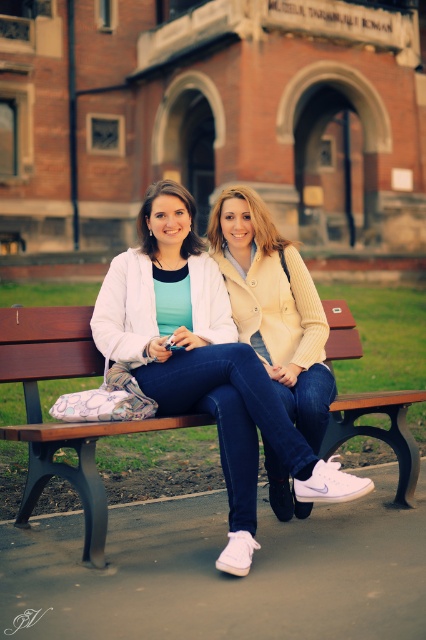
You are trying to decide whether to sit on the wooden bench at center or wear the matte yellow jacket at center. Which one is shorter in height?

The wooden bench at center is not as tall as matte yellow jacket at center, so the wooden bench at center is shorter in height.

You are standing at the entrance of the brick building and want to sit on the wooden bench at center. In which direction should you walk to reach the bench?

The wooden bench at center is located at point 0.661 on the x and 0.143 on the y axis. Since you are at the entrance of the brick building, you should walk towards the center of the image to reach the bench.